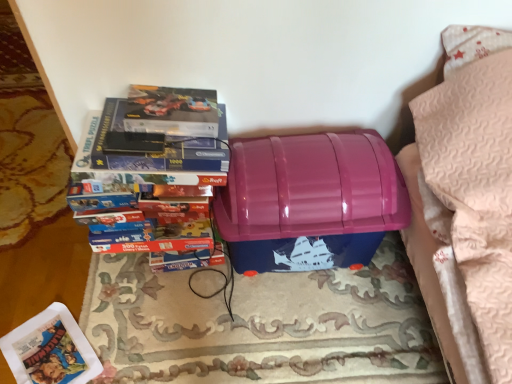
Image resolution: width=512 pixels, height=384 pixels. Identify the location of vacant space that's between blue cardboard puzzle at left and matte plastic paperback book at lower left. (x=119, y=307).